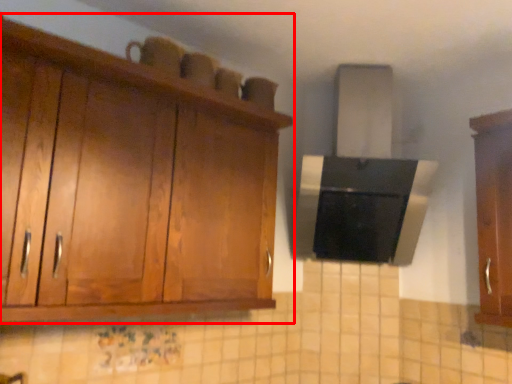
Question: Where is cabinetry (annotated by the red box) located in relation to cabinetry in the image?

Choices:
 (A) right
 (B) left

Answer: (B)